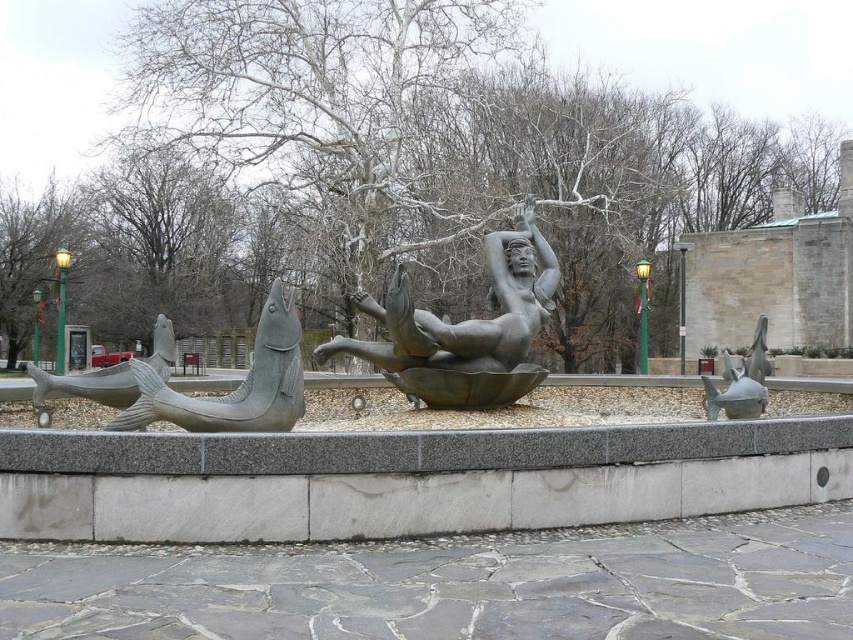
Based on the photo, is polished bronze fish at left wider than gray stone fish at left?

No, polished bronze fish at left is not wider than gray stone fish at left.

Which is more to the left, polished bronze fish at left or gray stone fish at left?

gray stone fish at left is more to the left.

This screenshot has width=853, height=640. What do you see at coordinates (236, 387) in the screenshot?
I see `polished bronze fish at left` at bounding box center [236, 387].

Image resolution: width=853 pixels, height=640 pixels. What are the coordinates of `polished bronze fish at left` in the screenshot? It's located at (236, 387).

Is gray stone fish at left thinner than satin silver fish at right?

No, gray stone fish at left is not thinner than satin silver fish at right.

Does point (28, 365) come closer to viewer compared to point (732, 381)?

Yes, point (28, 365) is in front of point (732, 381).

The width and height of the screenshot is (853, 640). In order to click on gray stone fish at left in this screenshot , I will do `click(86, 385)`.

Based on the photo, does bronze statue at center appear over gray stone fish at left?

Yes.

Is bronze statue at center thinner than gray stone fish at left?

Yes, bronze statue at center is thinner than gray stone fish at left.

Which is in front, point (474, 404) or point (125, 390)?

Point (125, 390)

Locate an element on the screen. The height and width of the screenshot is (640, 853). bronze statue at center is located at coordinates (465, 330).